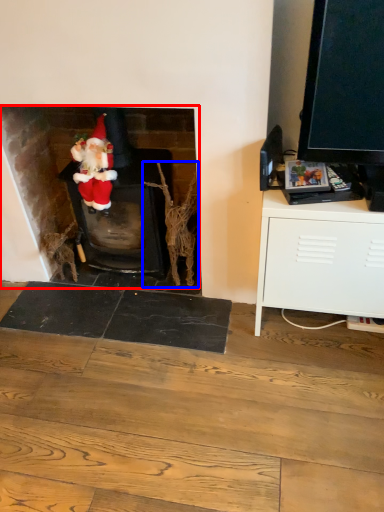
Question: Which point is closer to the camera, fireplace (highlighted by a red box) or branch (highlighted by a blue box)?

Choices:
 (A) fireplace
 (B) branch

Answer: (A)